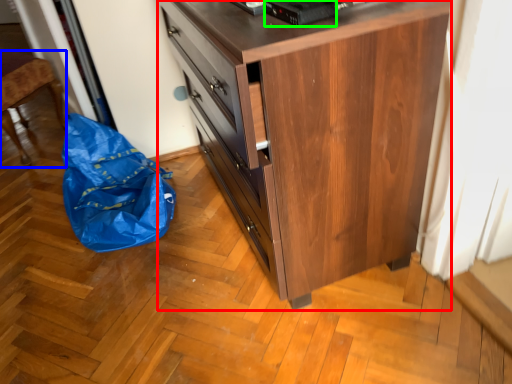
Question: Which object is positioned farthest from chest of drawers (highlighted by a red box)? Select from furniture (highlighted by a blue box) and appliance (highlighted by a green box).

Choices:
 (A) furniture
 (B) appliance

Answer: (A)